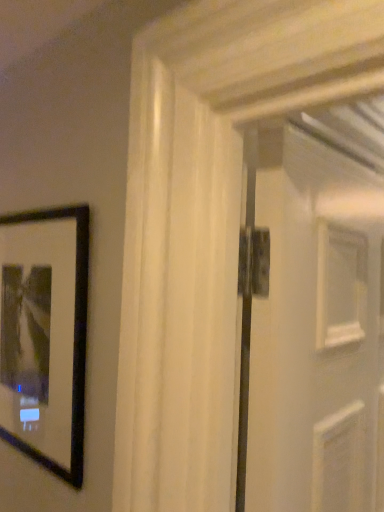
Describe the element at coordinates (314, 311) in the screenshot. I see `matte white screen door at right` at that location.

Image resolution: width=384 pixels, height=512 pixels. In order to click on matte white screen door at right in this screenshot , I will do `click(314, 311)`.

Looking at this image, measure the distance between point (285, 154) and camera.

Point (285, 154) and camera are 24.92 inches apart from each other.

Find the location of `matte white screen door at right`. matte white screen door at right is located at coordinates (314, 311).